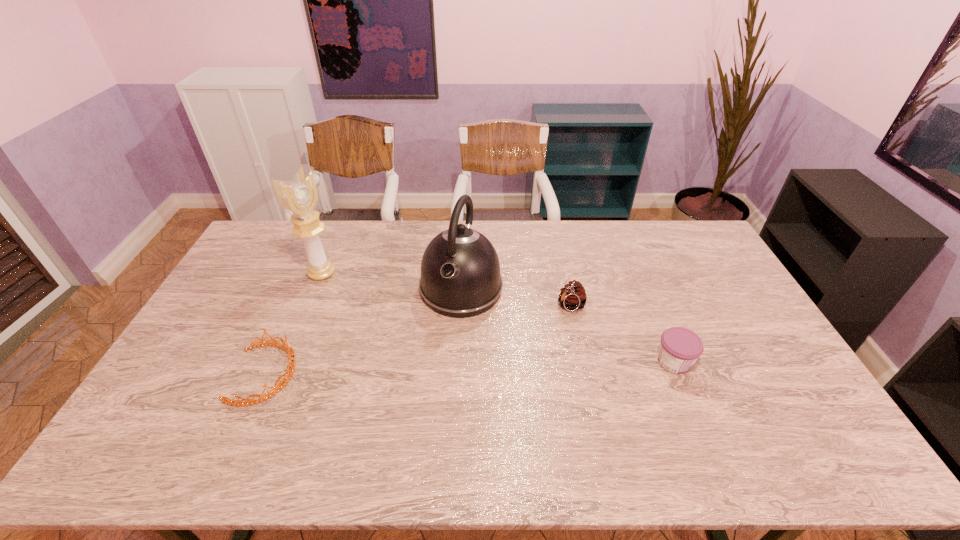
The image size is (960, 540). What are the coordinates of `tiara` in the screenshot? It's located at (289, 372).

Locate an element on the screen. the rightmost object is located at coordinates (680, 347).

This screenshot has height=540, width=960. I want to click on the second object from right to left, so click(572, 297).

The width and height of the screenshot is (960, 540). I want to click on award, so click(300, 197).

Where is `the fourth shortest object`? the fourth shortest object is located at coordinates (460, 271).

Locate an element on the screen. The width and height of the screenshot is (960, 540). the third object from left to right is located at coordinates (460, 271).

Locate an element on the screen. Image resolution: width=960 pixels, height=540 pixels. vacant space situated on the front-facing side of the tiara is located at coordinates (355, 374).

Identify the location of vacant region located on the front label of the jam. (729, 362).

You are a GUI agent. You are given a task and a screenshot of the screen. Output one action in this format:
    pyautogui.click(x=<x>, y=<y>)
    Task: Click on the vacant area situated with a leaf charm attached to the pinecone
    The height and width of the screenshot is (540, 960).
    Given the screenshot: What is the action you would take?
    pyautogui.click(x=522, y=346)

Locate an element on the screen. The image size is (960, 540). free space located 0.130m with a leaf charm attached to the pinecone is located at coordinates point(536,336).